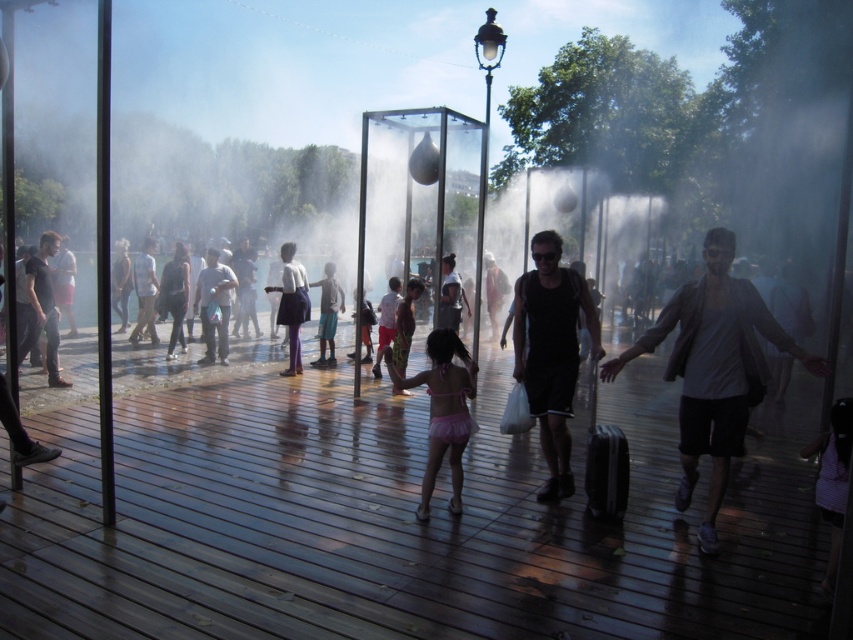
You are a photographer trying to capture a clear shot of both the gray cotton shirt at center and the black matte tank top at center. Since the mist from the fountain is causing some haze, which clothing item should you focus on first to ensure it appears sharp in the photo?

The gray cotton shirt at center is positioned on the right side of black matte tank top at center. To ensure both appear sharp, focus on the black matte tank top at center first since it is closer to the left, allowing you to adjust the focus accordingly for the rightward positioned gray cotton shirt at center.

You are a photographer trying to capture a clear shot of both the gray cotton shirt at center and the black matte tank top at center. Since the mist from the fountain might obstruct your view, which clothing item would you focus on first to ensure it appears taller in the photo?

The gray cotton shirt at center is taller than the black matte tank top at center, so focusing on it first would ensure its height is captured clearly despite the mist.